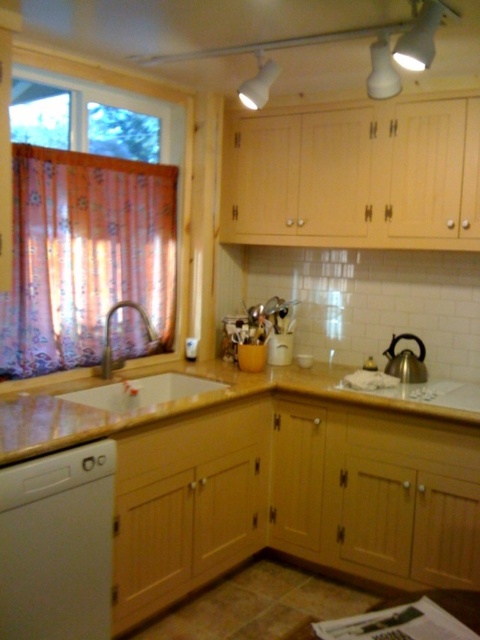
Question: Does floral fabric curtain at left have a lesser width compared to matte yellow sink at center?

Choices:
 (A) yes
 (B) no

Answer: (A)

Question: Does light brown laminate counter top at center have a lesser width compared to floral fabric curtain at left?

Choices:
 (A) no
 (B) yes

Answer: (A)

Question: Which object is positioned farthest from the floral fabric curtain at left?

Choices:
 (A) marble countertop at center
 (B) light brown laminate counter top at center

Answer: (B)

Question: Which of these objects is positioned closest to the matte yellow sink at center?

Choices:
 (A) marble countertop at center
 (B) white matte exhaust hood at upper center
 (C) white matte dishwasher at lower left
 (D) white glossy sink at center

Answer: (D)

Question: Which of the following is the farthest from the observer?

Choices:
 (A) marble countertop at center
 (B) white matte dishwasher at lower left
 (C) polished stainless steel kettle at right

Answer: (C)

Question: Can you confirm if floral fabric curtain at left is bigger than marble countertop at center?

Choices:
 (A) yes
 (B) no

Answer: (B)